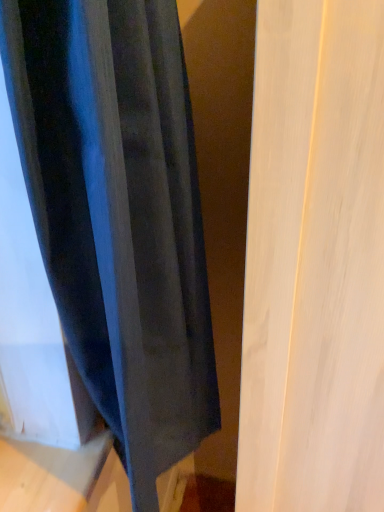
The height and width of the screenshot is (512, 384). I want to click on velvet blue curtain at left, so click(x=119, y=215).

What do you see at coordinates (119, 215) in the screenshot? The height and width of the screenshot is (512, 384). I see `velvet blue curtain at left` at bounding box center [119, 215].

Find the location of a particular element. The image size is (384, 512). velvet blue curtain at left is located at coordinates (119, 215).